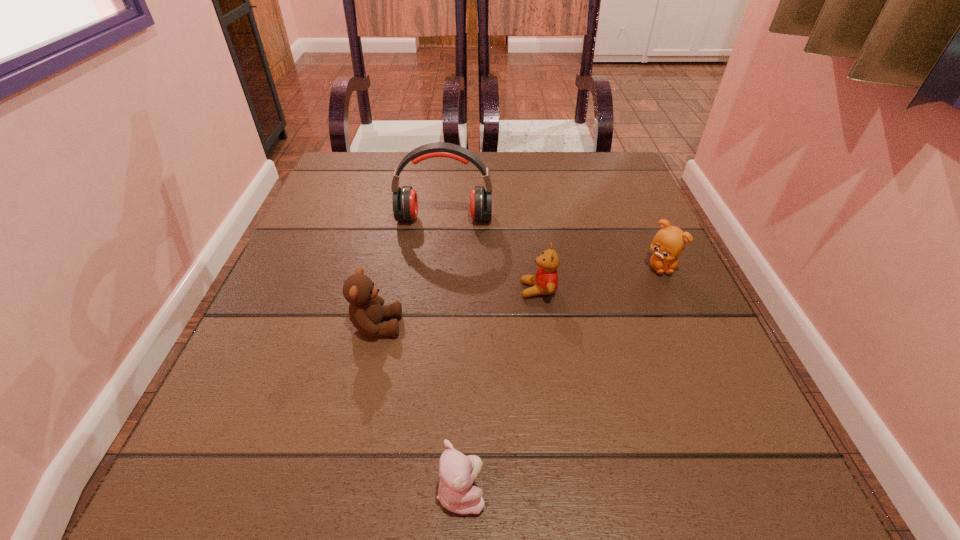
Where is `free space that is in between the third farthest teddy bear and the nearest teddy bear`? The width and height of the screenshot is (960, 540). free space that is in between the third farthest teddy bear and the nearest teddy bear is located at coordinates (419, 409).

This screenshot has width=960, height=540. Identify the location of free spot between the second teddy bear from right to left and the earphone. (492, 254).

Where is `blank region between the second teddy bear from right to left and the nearest teddy bear`? The height and width of the screenshot is (540, 960). blank region between the second teddy bear from right to left and the nearest teddy bear is located at coordinates (500, 390).

This screenshot has height=540, width=960. I want to click on object identified as the third closest to the earphone, so click(x=669, y=242).

Identify the location of object that stands as the second closest to the leftmost teddy bear. (457, 472).

Locate an element on the screen. teddy bear that is the second closest to the rightmost object is located at coordinates (366, 311).

Point out which teddy bear is positioned as the third nearest to the third teddy bear from left to right. Please provide its 2D coordinates. Your answer should be formatted as a tuple, i.e. [(x, y)], where the tuple contains the x and y coordinates of a point satisfying the conditions above.

[(457, 472)]

This screenshot has width=960, height=540. I want to click on free region that satisfies the following two spatial constraints: 1. on the face of the rightmost object; 2. on the front-facing side of the fourth object from left to right, so click(670, 290).

Where is `free space that satisfies the following two spatial constraints: 1. on the face of the rightmost teddy bear; 2. on the face of the fourth farthest object`? This screenshot has width=960, height=540. free space that satisfies the following two spatial constraints: 1. on the face of the rightmost teddy bear; 2. on the face of the fourth farthest object is located at coordinates (686, 326).

This screenshot has height=540, width=960. In order to click on free region that satisfies the following two spatial constraints: 1. on the ear cups of the earphone; 2. on the face of the fourth farthest object in this screenshot , I will do `click(434, 326)`.